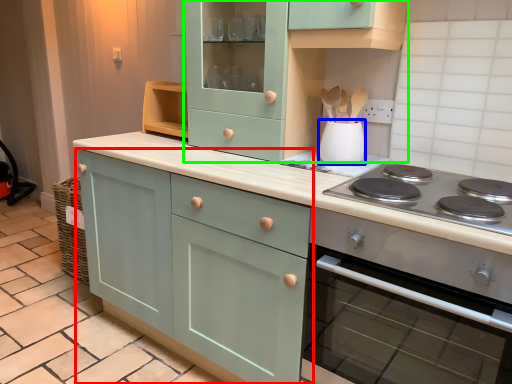
Question: Which is nearer to the cabinetry (highlighted by a red box)? kitchen appliance (highlighted by a blue box) or cabinetry (highlighted by a green box).

Choices:
 (A) kitchen appliance
 (B) cabinetry

Answer: (B)